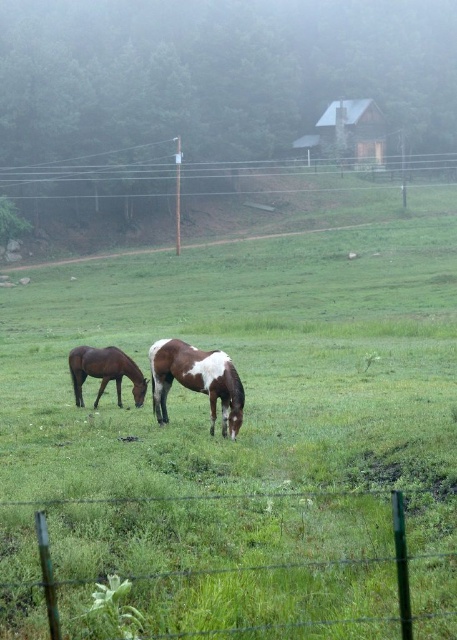
You are standing at the center of the image and want to walk towards the green wire fence at lower center. In which direction should you move?

You should move downward because the green wire fence at lower center is located at point (x=339, y=564), which is below your current position at the center.

You are a farmer checking the pasture. You see the green wire fence at lower center and the brown glossy horse at left. Which object takes up more space in the image?

The brown glossy horse at left takes up more space in the image than the green wire fence at lower center because the green wire fence at lower center occupies less space than brown glossy horse at left.

You are standing at the origin point in the image. Which direction should you move to reach the brown glossy horse at center?

Since the brown glossy horse at center is located at coordinates approximately 0.595 on the x and 0.431 on the y axis, you should move towards the right and slightly forward to reach it.